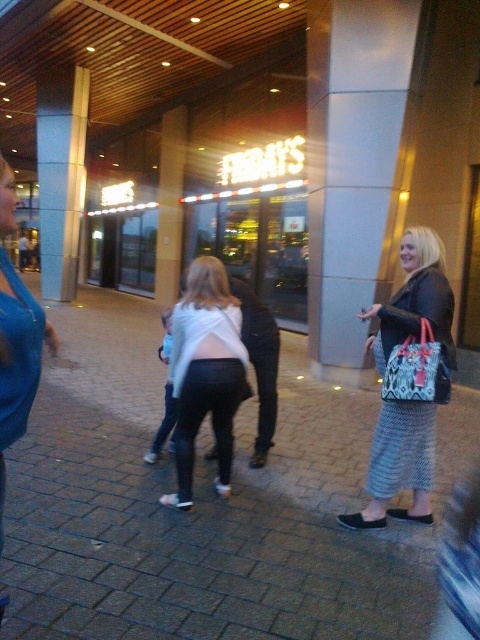
You are standing on the paved area and want to walk to the entrance of the building. Which pillar should you go around first, the metallic gray pillar at center or the wooden pillar at center?

The metallic gray pillar at center is located below the wooden pillar at center, so you should go around the metallic gray pillar at center first since it is closer to you on the paved area.

You are a photographer setting up a tripod to capture the neon sign above the entrance. You notice the white fabric top at center and the wooden pillar at center in your shot. Which object will appear shorter in the photo?

The white fabric top at center will appear shorter in the photo because it is not as tall as the wooden pillar at center.

From the picture: You are standing at the entrance of the building and see two points marked on the pavement. The first point is at coordinate point (350, 93) and the second is at point (170, 170). If you want to walk towards the point that is closer to the entrance, which coordinate should you head towards?

You should head towards point (350, 93) because it is in front of point (170, 170), meaning it is closer to the entrance.